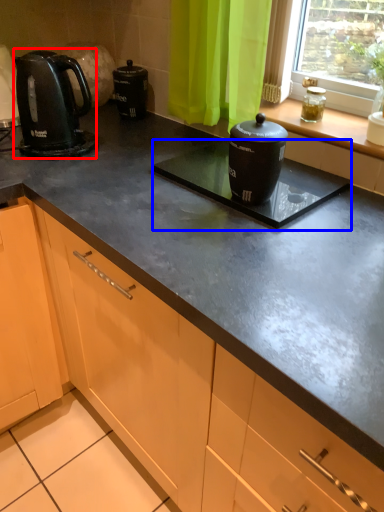
Question: Which of the following is the farthest to the observer, kitchen appliance (highlighted by a red box) or appliance (highlighted by a blue box)?

Choices:
 (A) kitchen appliance
 (B) appliance

Answer: (A)